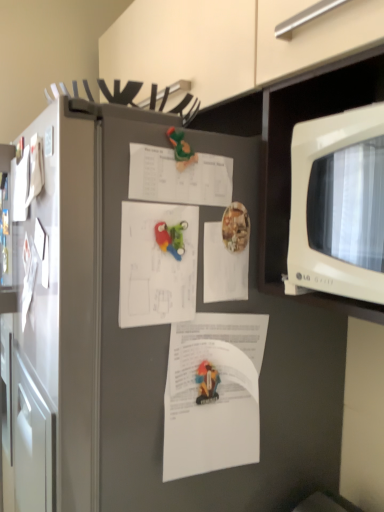
Measure the distance between point [178,255] and camera.

Point [178,255] is 29.37 inches away from camera.

What is the approximate height of white glossy microwave at right?

It is 25.77 centimeters.

The image size is (384, 512). Describe the element at coordinates (338, 204) in the screenshot. I see `white glossy microwave at right` at that location.

In order to face green plastic toy at center, the 1th toy when ordered from top to bottom, should I rotate leftwards or rightwards?

To face it directly, rotate left by 1.140 degrees.

Image resolution: width=384 pixels, height=512 pixels. I want to click on white paper at center, the second document in the top-to-bottom sequence, so click(x=223, y=267).

Where is `rubberized plastic toy at center, placed as the 1th toy when sorted from bottom to top`? rubberized plastic toy at center, placed as the 1th toy when sorted from bottom to top is located at coordinates (171, 238).

Based on the photo, from the image's perspective, which is below, white paper at center, positioned as the 3th document in top-to-bottom order, or white glossy microwave at right?

white paper at center, positioned as the 3th document in top-to-bottom order, from the image's perspective.

Is white paper at center, acting as the 2th document starting from the bottom, placed right next to white glossy microwave at right?

No, white paper at center, acting as the 2th document starting from the bottom, is not in contact with white glossy microwave at right.

Can you confirm if white paper at center, acting as the 2th document starting from the bottom, is smaller than white glossy microwave at right?

Yes, white paper at center, acting as the 2th document starting from the bottom, is smaller than white glossy microwave at right.

Is white paper at center, which is the 3th document in bottom-to-top order, directly adjacent to rubberized plastic toy at center, which ranks as the second toy in top-to-bottom order?

Yes, white paper at center, which is the 3th document in bottom-to-top order, and rubberized plastic toy at center, which ranks as the second toy in top-to-bottom order, clearly make contact.

Is white paper at center, the second document in the top-to-bottom sequence, to the left of rubberized plastic toy at center, placed as the 1th toy when sorted from bottom to top, from the viewer's perspective?

Incorrect, white paper at center, the second document in the top-to-bottom sequence, is not on the left side of rubberized plastic toy at center, placed as the 1th toy when sorted from bottom to top.

Is the position of white paper at center, which is the 3th document in bottom-to-top order, more distant than that of rubberized plastic toy at center, placed as the 1th toy when sorted from bottom to top?

Yes, it is.

Is white paper at center, which is the 3th document in bottom-to-top order, thinner than rubberized plastic toy at center, placed as the 1th toy when sorted from bottom to top?

Yes.

Visually, is white paper at center, positioned as the 3th document in top-to-bottom order, positioned to the left or to the right of rubberized plastic toy at center, placed as the 1th toy when sorted from bottom to top?

white paper at center, positioned as the 3th document in top-to-bottom order, is positioned on rubberized plastic toy at center, placed as the 1th toy when sorted from bottom to top,'s left side.

Locate an element on the screen. toy that is the 1st object to the right of the white paper at center, acting as the 2th document starting from the bottom, starting at the anchor is located at coordinates (171, 238).

Who is smaller, white paper at center, positioned as the 3th document in top-to-bottom order, or rubberized plastic toy at center, placed as the 1th toy when sorted from bottom to top?

rubberized plastic toy at center, placed as the 1th toy when sorted from bottom to top, is smaller.

From a real-world perspective, who is located higher, white paper at center, positioned as the 3th document in top-to-bottom order, or rubberized plastic toy at center, which ranks as the second toy in top-to-bottom order?

rubberized plastic toy at center, which ranks as the second toy in top-to-bottom order.

Based on the photo, does green plastic toy at center, the 2th toy from the bottom, lie in front of rubberized plastic toy at center, placed as the 1th toy when sorted from bottom to top?

That is False.

How far apart are green plastic toy at center, the 2th toy from the bottom, and rubberized plastic toy at center, placed as the 1th toy when sorted from bottom to top?

They are 4.89 inches apart.

Which is farther, (170, 139) or (176, 257)?

Positioned behind is point (176, 257).

Can you confirm if green plastic toy at center, the 1th toy when ordered from top to bottom, is thinner than rubberized plastic toy at center, which ranks as the second toy in top-to-bottom order?

Yes, green plastic toy at center, the 1th toy when ordered from top to bottom, is thinner than rubberized plastic toy at center, which ranks as the second toy in top-to-bottom order.

From a real-world perspective, is white paper at center, acting as the 2th document starting from the bottom, on white paper at center, the second document in the top-to-bottom sequence?

Yes.

Is the depth of white paper at center, acting as the 2th document starting from the bottom, greater than that of white paper at center, the second document in the top-to-bottom sequence?

No, white paper at center, acting as the 2th document starting from the bottom, is closer to the camera.

Considering the sizes of objects white paper at center, acting as the 2th document starting from the bottom, and white paper at center, the second document in the top-to-bottom sequence, in the image provided, who is wider, white paper at center, acting as the 2th document starting from the bottom, or white paper at center, the second document in the top-to-bottom sequence,?

white paper at center, the second document in the top-to-bottom sequence, is wider.

Is white paper at center, which is the 1th document from bottom to top, touching white glossy microwave at right?

No, white paper at center, which is the 1th document from bottom to top, is not next to white glossy microwave at right.

Is the position of white paper at center, which appears as the 4th document when viewed from the top, more distant than that of white glossy microwave at right?

That is True.

Is white paper at center, which is the 1th document from bottom to top, oriented away from white glossy microwave at right?

No, white paper at center, which is the 1th document from bottom to top, is not facing the opposite direction of white glossy microwave at right.

Considering the positions of objects white paper at center, which appears as the 4th document when viewed from the top, and white glossy microwave at right in the image provided, who is more to the right, white paper at center, which appears as the 4th document when viewed from the top, or white glossy microwave at right?

Positioned to the right is white glossy microwave at right.

From the picture: Which object is wider, white paper at center, which is the 1th document from bottom to top, or rubberized plastic toy at center, which ranks as the second toy in top-to-bottom order?

With larger width is white paper at center, which is the 1th document from bottom to top.

Is white paper at center, which is the 1th document from bottom to top, at the right side of rubberized plastic toy at center, placed as the 1th toy when sorted from bottom to top?

Indeed, white paper at center, which is the 1th document from bottom to top, is positioned on the right side of rubberized plastic toy at center, placed as the 1th toy when sorted from bottom to top.

From a real-world perspective, between white paper at center, which appears as the 4th document when viewed from the top, and rubberized plastic toy at center, which ranks as the second toy in top-to-bottom order, who is vertically higher?

rubberized plastic toy at center, which ranks as the second toy in top-to-bottom order, from a real-world perspective.

Who is smaller, white paper at center, which appears as the 4th document when viewed from the top, or rubberized plastic toy at center, placed as the 1th toy when sorted from bottom to top?

rubberized plastic toy at center, placed as the 1th toy when sorted from bottom to top, is smaller.

The height and width of the screenshot is (512, 384). What are the coordinates of `document that is the 4th object to the left of the white glossy microwave at right, starting at the anchor` in the screenshot? It's located at (157, 264).

I want to click on the 1st document below when counting from the rubberized plastic toy at center, which ranks as the second toy in top-to-bottom order (from the image's perspective), so [223, 267].

When comparing their distances from rubberized plastic toy at center, which ranks as the second toy in top-to-bottom order, does white paper at center, which is the 1th document from bottom to top, or white paper at upper center, which is the fourth document from bottom to top, seem closer?

Based on the image, white paper at upper center, which is the fourth document from bottom to top, appears to be nearer to rubberized plastic toy at center, which ranks as the second toy in top-to-bottom order.

Based on the photo, based on their spatial positions, is white paper at center, positioned as the 3th document in top-to-bottom order, or white glossy microwave at right closer to rubberized plastic toy at center, placed as the 1th toy when sorted from bottom to top?

Among the two, white paper at center, positioned as the 3th document in top-to-bottom order, is located nearer to rubberized plastic toy at center, placed as the 1th toy when sorted from bottom to top.

Looking at the image, which one is located further to white glossy microwave at right, white paper at center, which is the 1th document from bottom to top, or rubberized plastic toy at center, placed as the 1th toy when sorted from bottom to top?

white paper at center, which is the 1th document from bottom to top, lies further to white glossy microwave at right than the other object.

When comparing their distances from rubberized plastic toy at center, placed as the 1th toy when sorted from bottom to top, does green plastic toy at center, the 1th toy when ordered from top to bottom, or white glossy microwave at right seem further?

Based on the image, white glossy microwave at right appears to be further to rubberized plastic toy at center, placed as the 1th toy when sorted from bottom to top.

Which object lies nearer to the anchor point rubberized plastic toy at center, which ranks as the second toy in top-to-bottom order, white paper at center, which is the 3th document in bottom-to-top order, or green plastic toy at center, the 2th toy from the bottom?

white paper at center, which is the 3th document in bottom-to-top order, is positioned closer to the anchor rubberized plastic toy at center, which ranks as the second toy in top-to-bottom order.

In the scene shown: Estimate the real-world distances between objects in this image. Which object is further from white paper at upper center, which is the fourth document from bottom to top, white glossy microwave at right or rubberized plastic toy at center, which ranks as the second toy in top-to-bottom order?

white glossy microwave at right is further to white paper at upper center, which is the fourth document from bottom to top.

Based on their spatial positions, is white paper at upper center, which is the fourth document from bottom to top, or rubberized plastic toy at center, placed as the 1th toy when sorted from bottom to top, closer to white glossy microwave at right?

white paper at upper center, which is the fourth document from bottom to top, lies closer to white glossy microwave at right than the other object.

When comparing their distances from white glossy microwave at right, does white paper at center, positioned as the 3th document in top-to-bottom order, or green plastic toy at center, the 2th toy from the bottom, seem closer?

white paper at center, positioned as the 3th document in top-to-bottom order, is positioned closer to the anchor white glossy microwave at right.

Image resolution: width=384 pixels, height=512 pixels. Identify the location of microwave oven between green plastic toy at center, the 1th toy when ordered from top to bottom, and white paper at center, which appears as the 4th document when viewed from the top, vertically. (338, 204).

The height and width of the screenshot is (512, 384). I want to click on toy between white paper at upper center, positioned as the 1th document in top-to-bottom order, and white paper at center, which appears as the 4th document when viewed from the top, from top to bottom, so click(x=171, y=238).

This screenshot has height=512, width=384. What are the coordinates of `microwave oven between white paper at upper center, which is the fourth document from bottom to top, and white paper at center, which is the 1th document from bottom to top, from top to bottom` in the screenshot? It's located at (338, 204).

I want to click on toy between rubberized plastic toy at center, which ranks as the second toy in top-to-bottom order, and white glossy microwave at right, so click(181, 149).